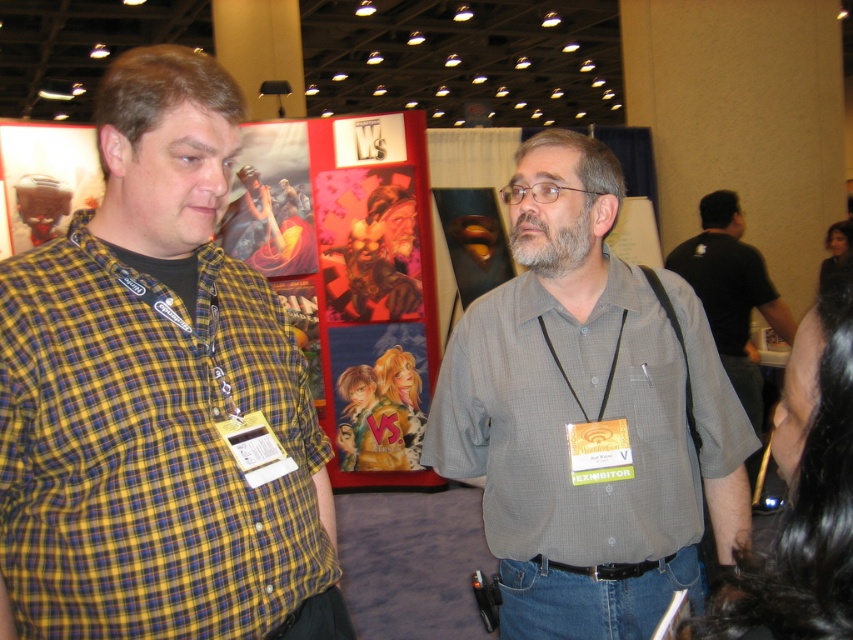
You are navigating through the convention space and need to reach a specific location. You see two reference points marked as point 1 at coordinates point (198, 572) and point 2 at coordinates point (682, 275). Which point should you head towards if you want to move closer to the front of the event space?

Point 1 at coordinates point (198, 572) is in front of point 2 at coordinates point (682, 275), so you should head towards point 1 to move closer to the front of the event space.

You are organizing a photo shoot and need to place the gray checkered shirt at center and the black shirt at right in a way that maintains their relative sizes as shown. If you want to ensure the smaller one is closer to the camera, which shirt should you position nearer?

The gray checkered shirt at center is smaller than the black shirt at right, so to maintain their sizes, the gray checkered shirt at center should be positioned closer to the camera.